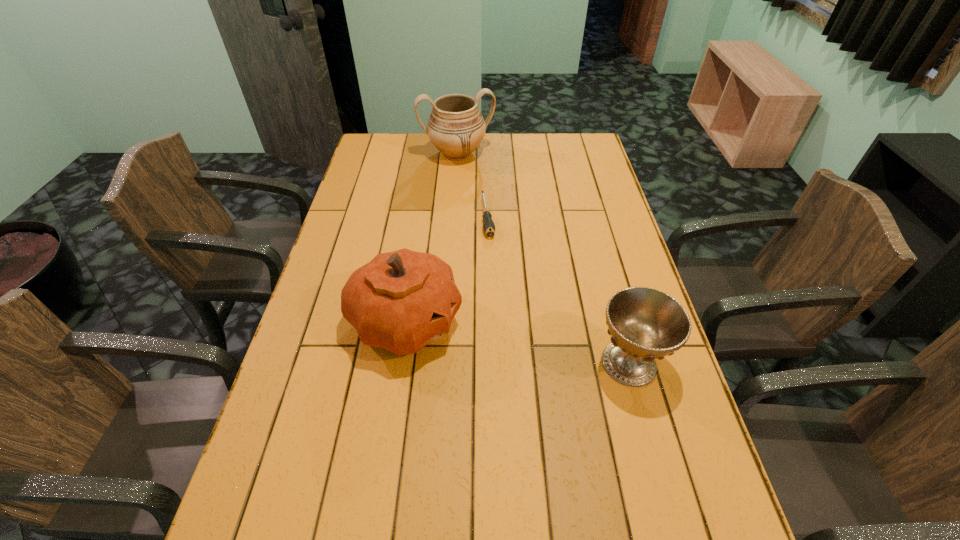
Where is `pumpkin`? The height and width of the screenshot is (540, 960). pumpkin is located at coordinates (401, 301).

Find the location of `the rightmost object`. the rightmost object is located at coordinates (645, 324).

I want to click on the third tallest object, so (645, 324).

The image size is (960, 540). Identify the location of the farthest object. (456, 127).

The width and height of the screenshot is (960, 540). Identify the location of the shortest object. (488, 225).

You are a GUI agent. You are given a task and a screenshot of the screen. Output one action in this format:
    pyautogui.click(x=<x>, y=<y>)
    Task: Click on the second farthest object
    The image size is (960, 540).
    Given the screenshot: What is the action you would take?
    pyautogui.click(x=488, y=225)

The width and height of the screenshot is (960, 540). In order to click on vacant space located on the front-facing side of the pumpkin in this screenshot , I will do `click(535, 322)`.

Where is `vacant space located 0.140m on the left of the rightmost object`? vacant space located 0.140m on the left of the rightmost object is located at coordinates (536, 363).

Identify the location of free space located on the front-facing side of the urn. The height and width of the screenshot is (540, 960). (476, 202).

Identify the location of free point located 0.230m on the front-facing side of the urn. (x=477, y=204).